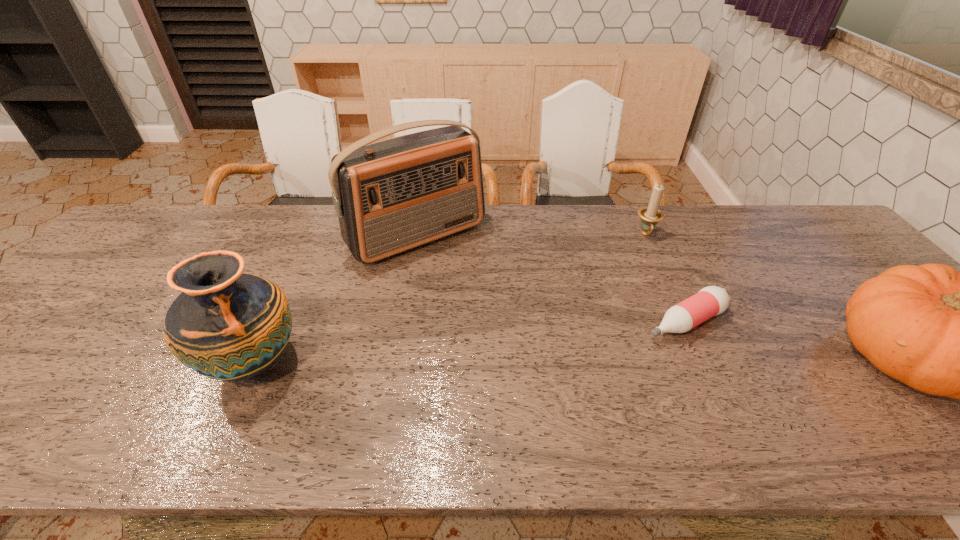
Identify which object is the fourth closest to the rightmost object. Please provide its 2D coordinates. Your answer should be formatted as a tuple, i.e. [(x, y)], where the tuple contains the x and y coordinates of a point satisfying the conditions above.

[(230, 326)]

Where is `vacant area in the image that satisfies the following two spatial constraints: 1. on the back side of the shortest object; 2. on the right side of the candle_holder`? The height and width of the screenshot is (540, 960). vacant area in the image that satisfies the following two spatial constraints: 1. on the back side of the shortest object; 2. on the right side of the candle_holder is located at coordinates 645,234.